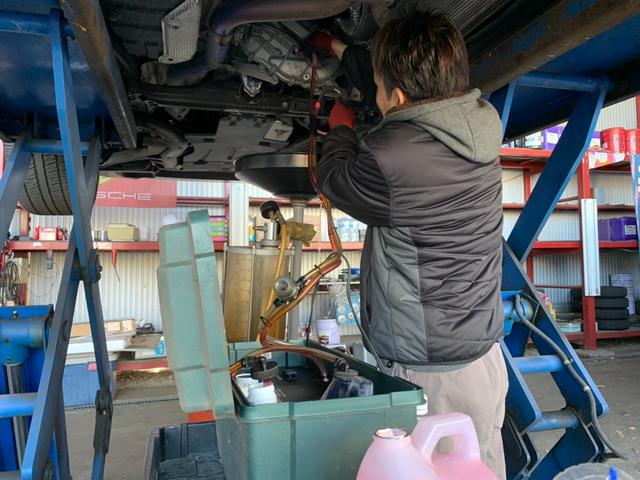
Locate an element on the screen. The width and height of the screenshot is (640, 480). red piping/shelves is located at coordinates (559, 246), (582, 325), (614, 243), (537, 152).